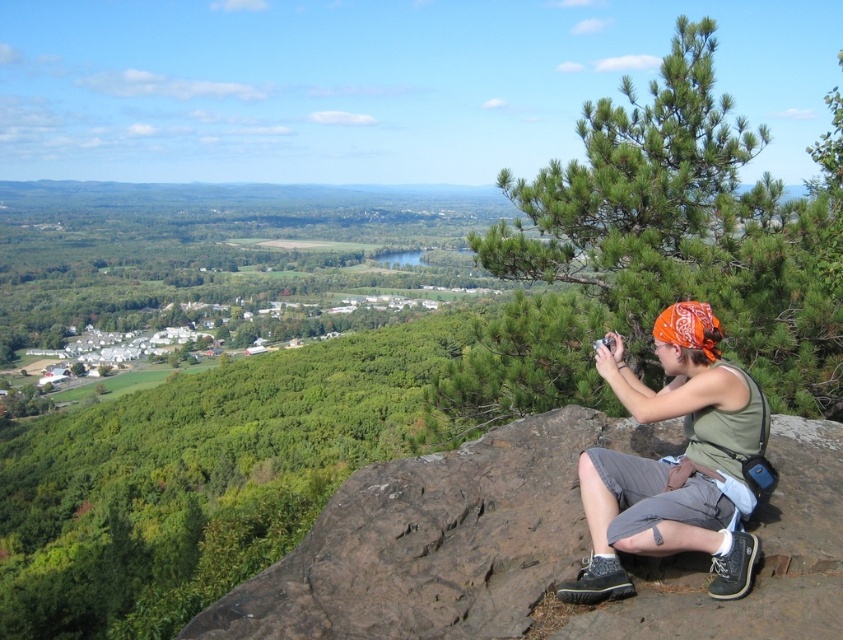
Question: Is brown rough rock at center further to the viewer compared to green fabric tank top at center?

Choices:
 (A) yes
 (B) no

Answer: (B)

Question: Does brown rough rock at center come in front of green fabric tank top at center?

Choices:
 (A) no
 (B) yes

Answer: (B)

Question: Is brown rough rock at center bigger than green fabric tank top at center?

Choices:
 (A) no
 (B) yes

Answer: (B)

Question: Which point is farther to the camera?

Choices:
 (A) green fabric tank top at center
 (B) brown rough rock at center

Answer: (A)